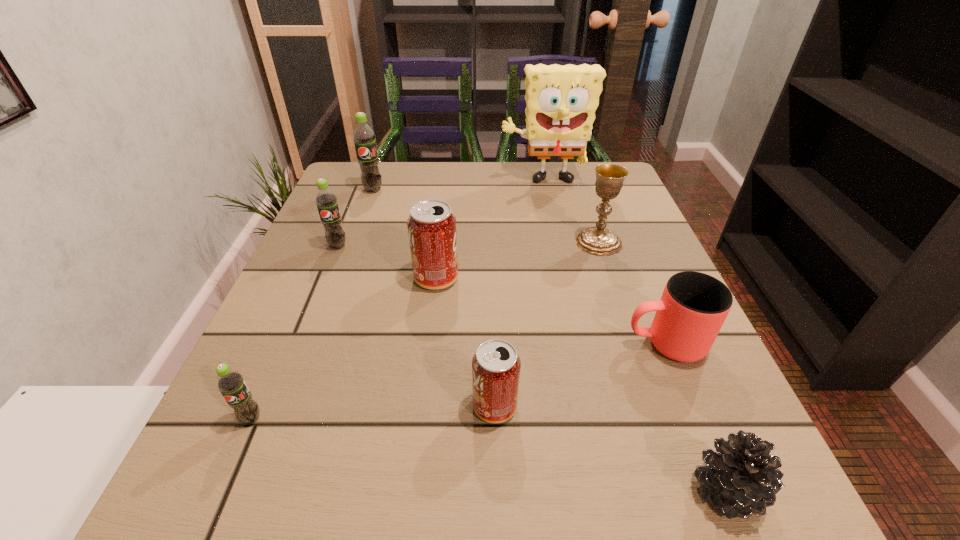
Find the location of a particular element. The height and width of the screenshot is (540, 960). the sixth farthest object is located at coordinates (693, 307).

Where is `the rightmost soda`? The height and width of the screenshot is (540, 960). the rightmost soda is located at coordinates (496, 366).

Locate an element on the screen. The image size is (960, 540). the nearer red soda can is located at coordinates (496, 366).

The image size is (960, 540). I want to click on the smallest green soda, so click(x=231, y=384).

In order to click on the nearest object in this screenshot , I will do `click(743, 478)`.

Where is `brown pinecone`? This screenshot has height=540, width=960. brown pinecone is located at coordinates (743, 478).

The width and height of the screenshot is (960, 540). Identify the location of blank space located on the face of the yellow sponge. (550, 215).

Find the location of `blank space located 0.190m on the front label of the biggest green soda`. blank space located 0.190m on the front label of the biggest green soda is located at coordinates (355, 240).

Locate an element on the screen. Image resolution: width=960 pixels, height=540 pixels. free space located 0.110m on the back of the chalice is located at coordinates (586, 203).

You are a GUI agent. You are given a task and a screenshot of the screen. Output one action in this format:
    pyautogui.click(x=<x>, y=<y>)
    Task: Click on the vacant space located 0.390m on the front label of the second farthest green soda
    This screenshot has height=540, width=960.
    Given the screenshot: What is the action you would take?
    pyautogui.click(x=268, y=419)